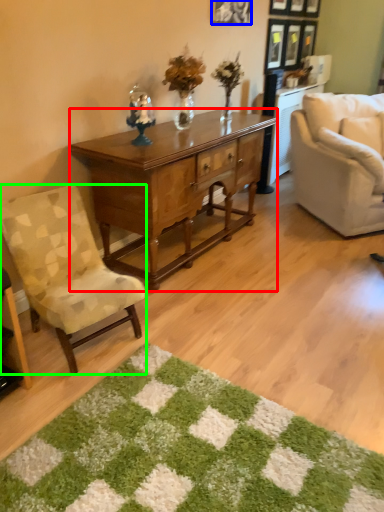
Question: Estimate the real-world distances between objects in this image. Which object is farther from desk (highlighted by a red box), picture frame (highlighted by a blue box) or chair (highlighted by a green box)?

Choices:
 (A) picture frame
 (B) chair

Answer: (A)